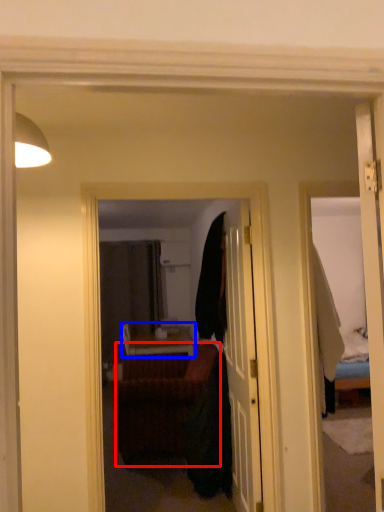
Question: Which object is closer to the camera taking this photo, studio couch (highlighted by a red box) or table (highlighted by a blue box)?

Choices:
 (A) studio couch
 (B) table

Answer: (A)